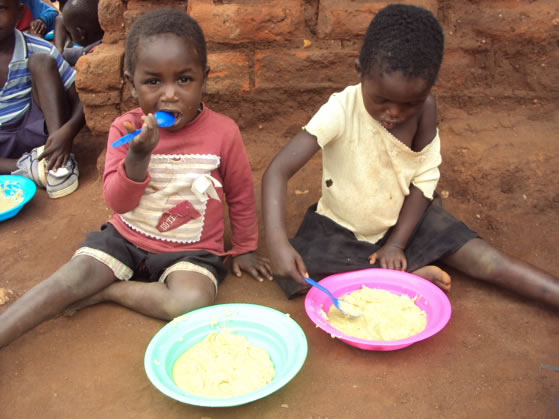
The height and width of the screenshot is (419, 559). In order to click on blue plate in this screenshot , I will do `click(29, 183)`.